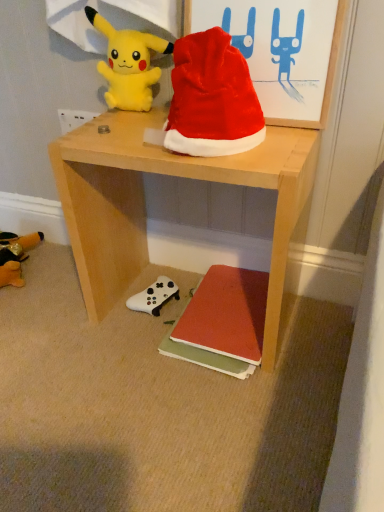
At what (x,y) coordinates should I click in order to perform the action: click on free space in front of red matte book at lower center. Please return your answer as a coordinate pair (x, y). This screenshot has width=384, height=512. Looking at the image, I should click on (237, 412).